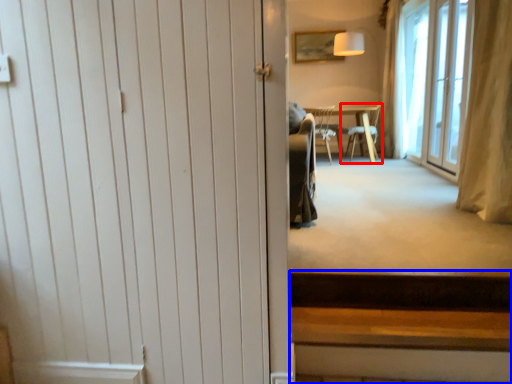
Question: Which object is further to the camera taking this photo, chair (highlighted by a red box) or stairs (highlighted by a blue box)?

Choices:
 (A) chair
 (B) stairs

Answer: (A)